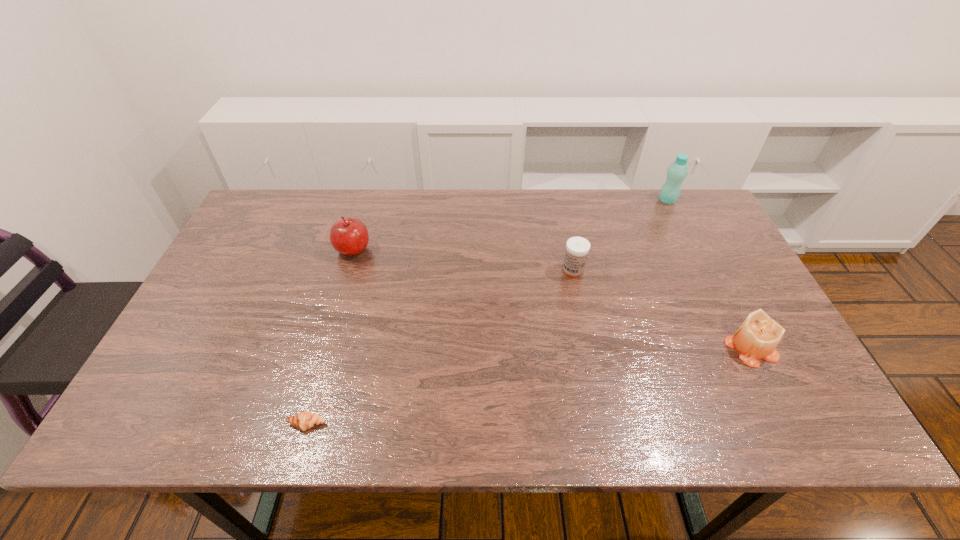
Locate an element on the screen. The height and width of the screenshot is (540, 960). free space located 0.120m on the back of the candle is located at coordinates (724, 295).

Locate an element on the screen. vacant area located on the back of the third nearest object is located at coordinates (568, 247).

Locate an element on the screen. The height and width of the screenshot is (540, 960). object positioned at the far edge is located at coordinates (677, 171).

Identify the location of object located at the near edge. The height and width of the screenshot is (540, 960). (305, 420).

Find the location of a particular element. bottle that is at the right edge is located at coordinates (677, 171).

This screenshot has height=540, width=960. What are the coordinates of `candle present at the right edge` in the screenshot? It's located at (757, 337).

Find the location of a particular element. The image size is (960, 540). object positioned at the far right corner is located at coordinates (677, 171).

This screenshot has height=540, width=960. In order to click on free space at the far edge of the desktop in this screenshot , I will do `click(471, 228)`.

Find the location of a particular element. The height and width of the screenshot is (540, 960). free space at the near edge of the desktop is located at coordinates [x=603, y=406].

The height and width of the screenshot is (540, 960). In the image, there is a desktop. What are the coordinates of `vacant space at the left edge` in the screenshot? It's located at (256, 249).